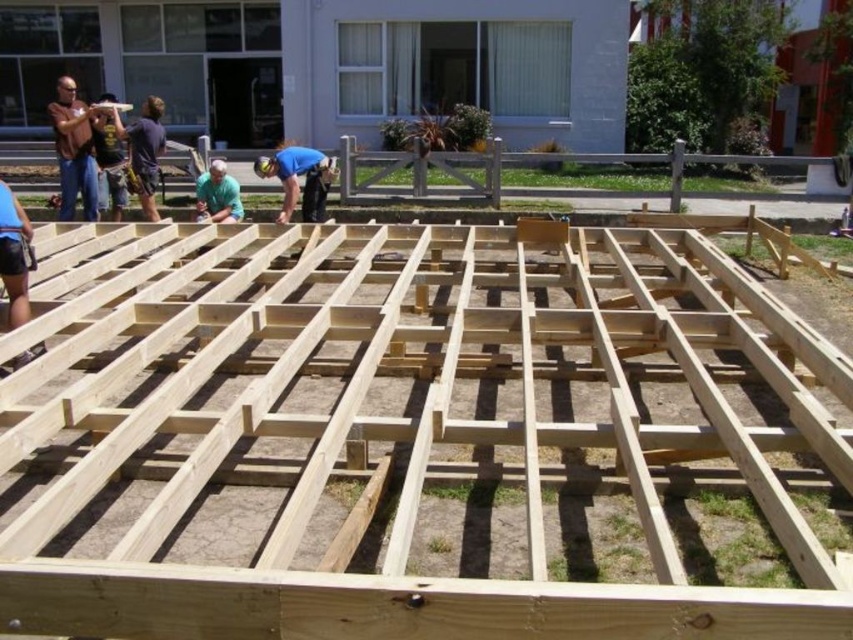
Question: Observing the image, what is the correct spatial positioning of matte brown shirt at left in reference to light blue shirt at center?

Choices:
 (A) below
 (B) above

Answer: (B)

Question: Which of the following is the closest to the observer?

Choices:
 (A) light blue shirt at center
 (B) matte brown shirt at left

Answer: (B)

Question: Does matte brown shirt at left have a smaller size compared to light blue shirt at center?

Choices:
 (A) no
 (B) yes

Answer: (A)

Question: Among these objects, which one is farthest from the camera?

Choices:
 (A) light blue shirt at center
 (B) matte brown shirt at left

Answer: (A)

Question: From the image, what is the correct spatial relationship of matte brown shirt at left in relation to light blue shirt at center?

Choices:
 (A) below
 (B) above

Answer: (B)